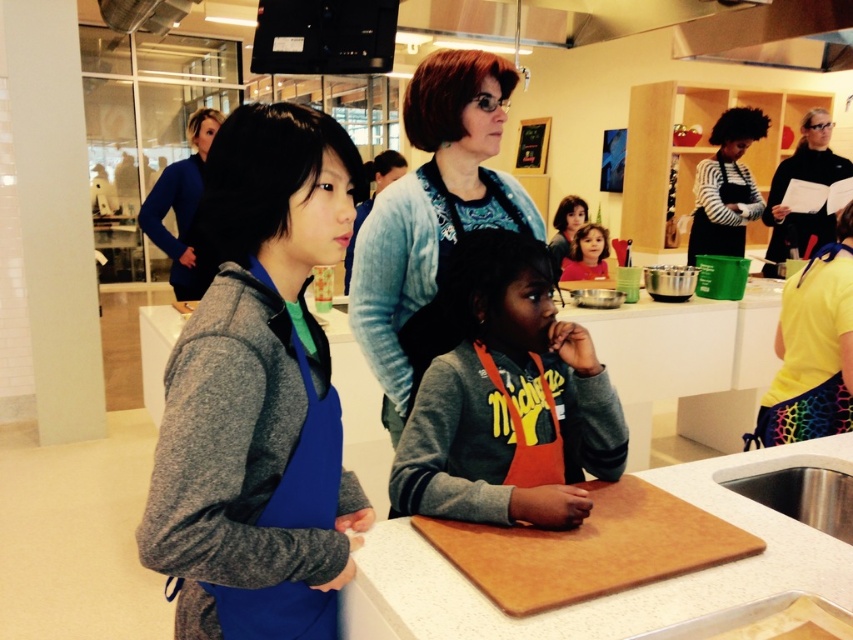
Question: Is orange apron at center wider than brown wooden cutting board at lower center?

Choices:
 (A) yes
 (B) no

Answer: (B)

Question: Which of the following is the farthest from the observer?

Choices:
 (A) black matte apron at upper right
 (B) blue denim jacket at center
 (C) blue sweater at upper left
 (D) matte orange apron at center

Answer: (D)

Question: Is orange apron at center bigger than black matte apron at upper right?

Choices:
 (A) yes
 (B) no

Answer: (B)

Question: Does black striped shirt at center appear on the left side of blue sweater at upper left?

Choices:
 (A) yes
 (B) no

Answer: (B)

Question: Among these points, which one is nearest to the camera?

Choices:
 (A) (567, 563)
 (B) (773, 260)
 (C) (749, 195)
 (D) (451, 340)

Answer: (A)

Question: Estimate the real-world distances between objects in this image. Which object is farther from the blue denim jacket at center?

Choices:
 (A) brown wooden cutting board at center
 (B) black striped shirt at center
 (C) matte gray hoodie at center

Answer: (B)